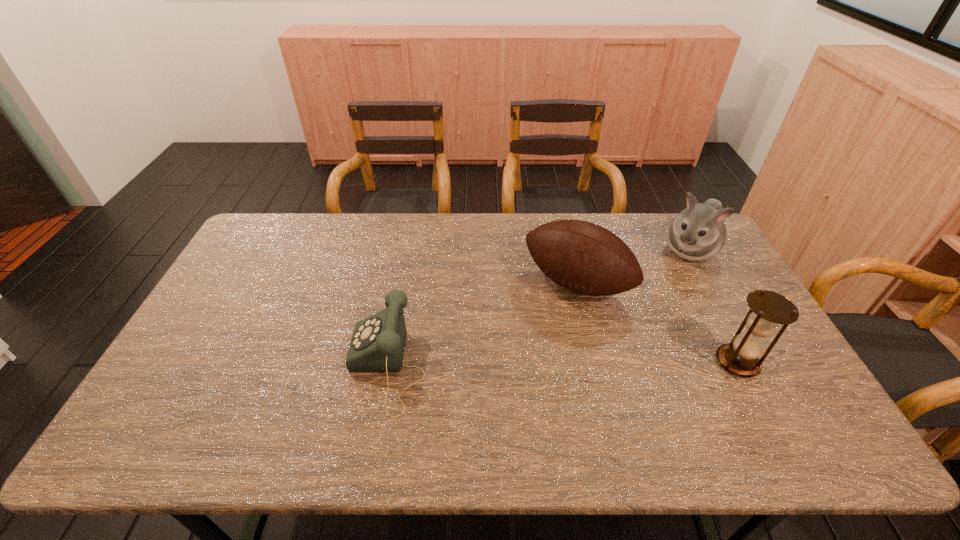
Find the location of `vacant space on the desktop that is between the telephone and the hourglass and is positioned on the face of the hamster`. vacant space on the desktop that is between the telephone and the hourglass and is positioned on the face of the hamster is located at coordinates (612, 363).

Identify the location of vacant space on the desktop that is between the leftmost object and the hourglass and is positioned on the laces of the second object from left to right. (521, 365).